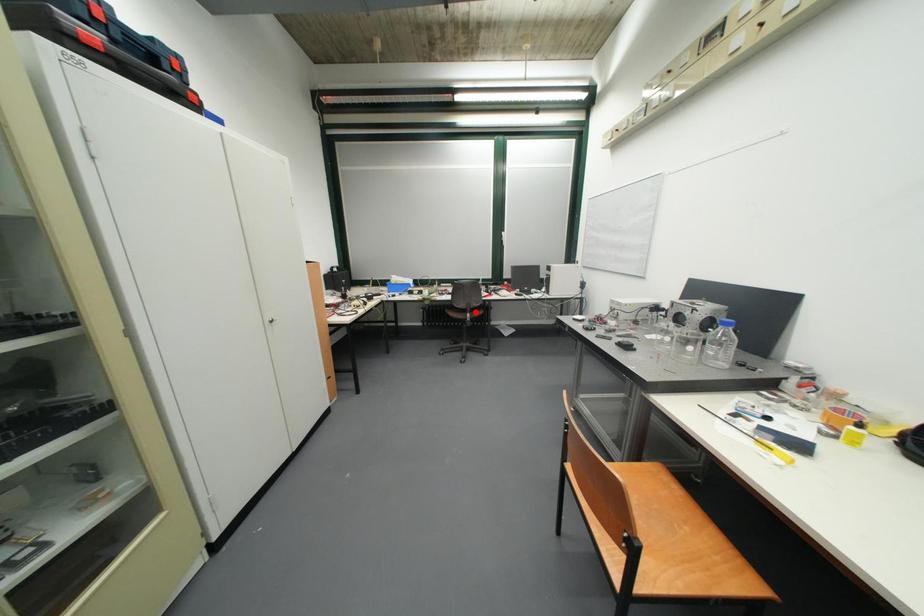
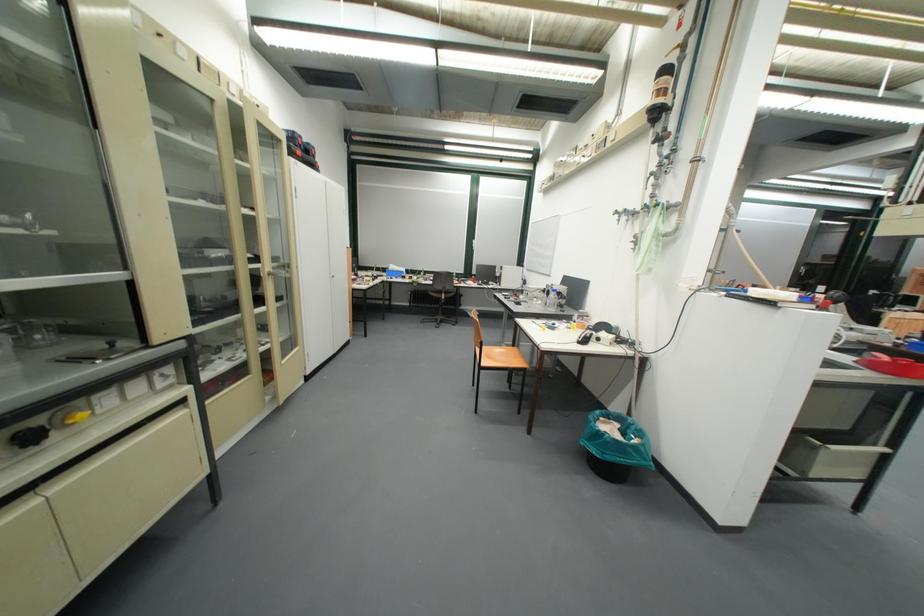
Find the pixel in the second image that matches the highlighted location in the first image.

(453, 293)